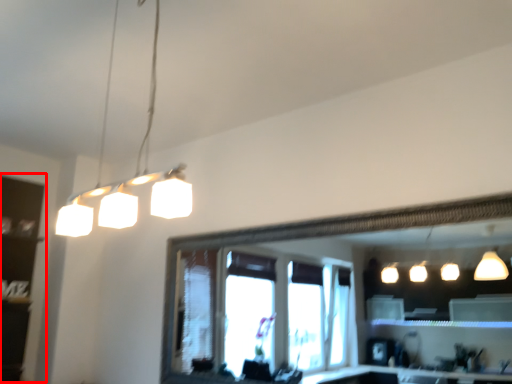
Question: From the image's perspective, what is the correct spatial positioning of shelf (annotated by the red box) in reference to lamp?

Choices:
 (A) above
 (B) below

Answer: (B)